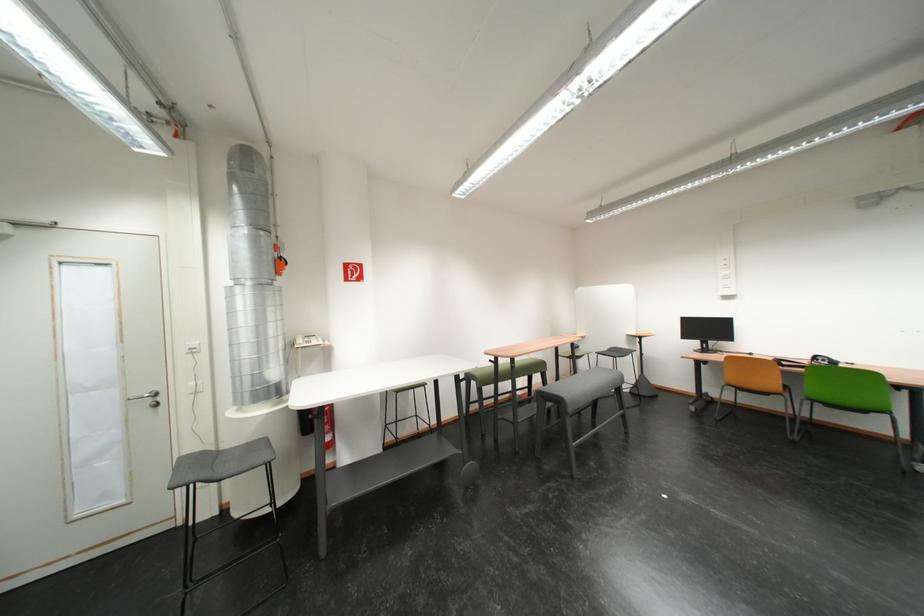
What are the coordinates of `white telephone handset` in the screenshot? It's located at (307, 341).